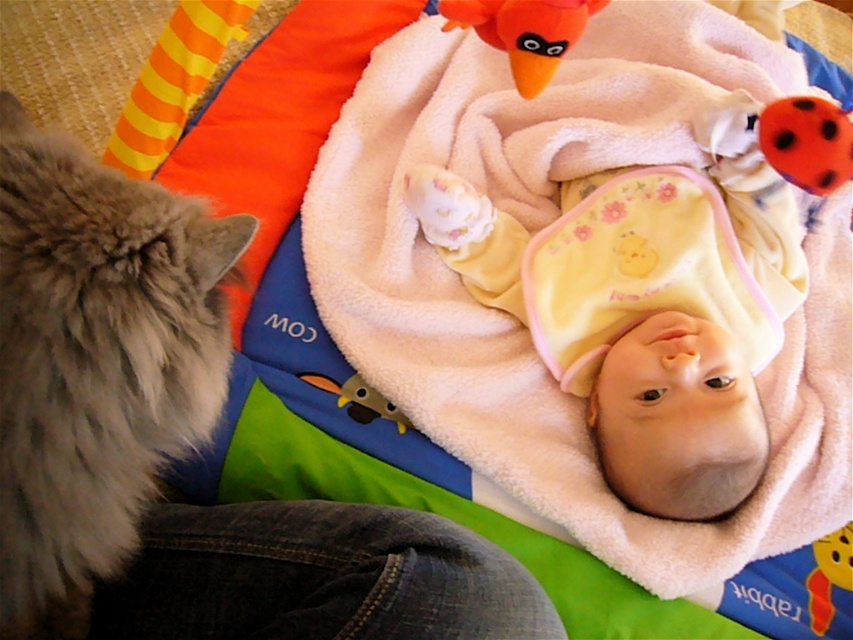
You are a parent trying to choose a toy for your baby. You have two options in the image provided. The red plush bear at upper center and the fuzzy yellow duckling at center. Which toy is thinner and might be easier for the baby to hold?

The red plush bear at upper center is thinner than the fuzzy yellow duckling at center, so it might be easier for the baby to hold.

You are a parent trying to locate your baby toys. You remember placing a red plush bear at upper center and a fuzzy yellow duckling at center. Which toy is positioned higher in the image?

The fuzzy yellow duckling at center is positioned higher than the red plush bear at upper center because the red plush bear at upper center is located below it.